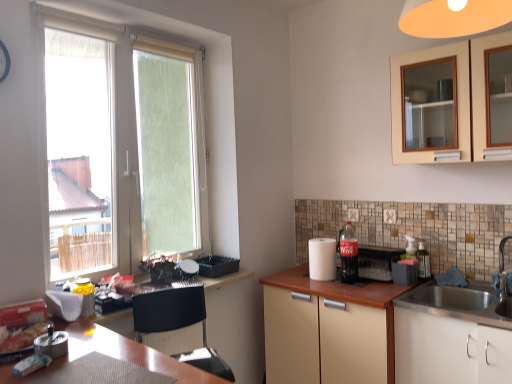
Question: Does beige matte cabinet at center, the 2th cabinetry positioned from the right, have a greater width compared to white plastic window at left?

Choices:
 (A) no
 (B) yes

Answer: (B)

Question: Can you confirm if beige matte cabinet at center, the 1th cabinetry positioned from the left, is positioned to the right of white plastic window at left?

Choices:
 (A) yes
 (B) no

Answer: (A)

Question: Considering the relative positions of beige matte cabinet at center, the 2th cabinetry positioned from the right, and white plastic window at left in the image provided, is beige matte cabinet at center, the 2th cabinetry positioned from the right, behind white plastic window at left?

Choices:
 (A) yes
 (B) no

Answer: (A)

Question: Are beige matte cabinet at center, the 2th cabinetry positioned from the right, and white plastic window at left far apart?

Choices:
 (A) yes
 (B) no

Answer: (A)

Question: Does beige matte cabinet at center, the 2th cabinetry positioned from the right, have a lesser width compared to white plastic window at left?

Choices:
 (A) yes
 (B) no

Answer: (B)

Question: Can you confirm if beige matte cabinet at center, the 1th cabinetry positioned from the left, is bigger than white plastic window at left?

Choices:
 (A) no
 (B) yes

Answer: (B)

Question: Considering the relative sizes of white paper towel at center, which appears as the 1th appliance when viewed from the left, and beige matte cabinet at center, the 1th cabinetry positioned from the left, in the image provided, is white paper towel at center, which appears as the 1th appliance when viewed from the left, thinner than beige matte cabinet at center, the 1th cabinetry positioned from the left,?

Choices:
 (A) no
 (B) yes

Answer: (B)

Question: Considering the relative sizes of white paper towel at center, which appears as the second appliance when viewed from the right, and beige matte cabinet at center, the 1th cabinetry positioned from the left, in the image provided, is white paper towel at center, which appears as the second appliance when viewed from the right, wider than beige matte cabinet at center, the 1th cabinetry positioned from the left,?

Choices:
 (A) yes
 (B) no

Answer: (B)

Question: Is white paper towel at center, which appears as the second appliance when viewed from the right, looking in the opposite direction of beige matte cabinet at center, the 1th cabinetry positioned from the left?

Choices:
 (A) no
 (B) yes

Answer: (A)

Question: Is white paper towel at center, which appears as the second appliance when viewed from the right, surrounding beige matte cabinet at center, the 1th cabinetry positioned from the left?

Choices:
 (A) no
 (B) yes

Answer: (A)

Question: From a real-world perspective, does white paper towel at center, which appears as the 1th appliance when viewed from the left, sit lower than beige matte cabinet at center, the 2th cabinetry positioned from the right?

Choices:
 (A) yes
 (B) no

Answer: (B)

Question: From the image's perspective, does white paper towel at center, which appears as the second appliance when viewed from the right, appear higher than white glossy sink at lower right, marked as the second cabinetry in a left-to-right arrangement?

Choices:
 (A) no
 (B) yes

Answer: (B)